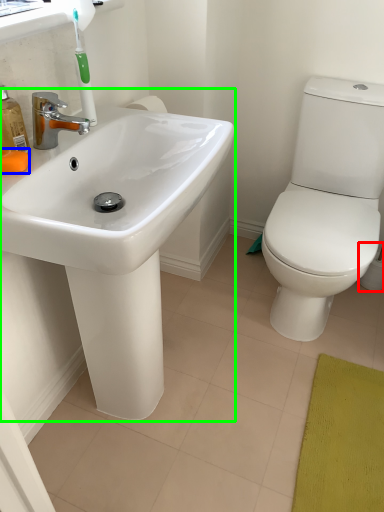
Question: Which object is positioned closest to toilet paper (highlighted by a red box)? Select from soap (highlighted by a blue box) and sink (highlighted by a green box).

Choices:
 (A) soap
 (B) sink

Answer: (B)